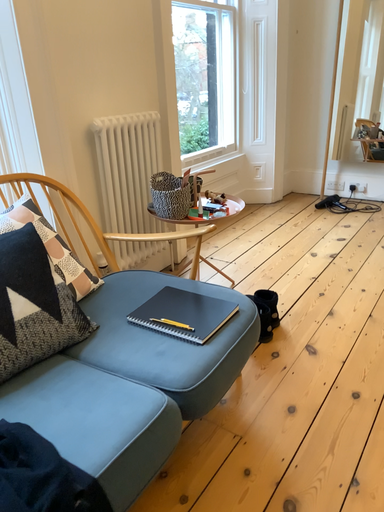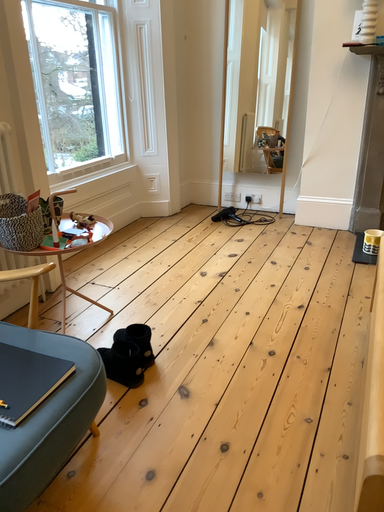
Question: Which way did the camera rotate in the video?

Choices:
 (A) rotated left
 (B) rotated right

Answer: (B)